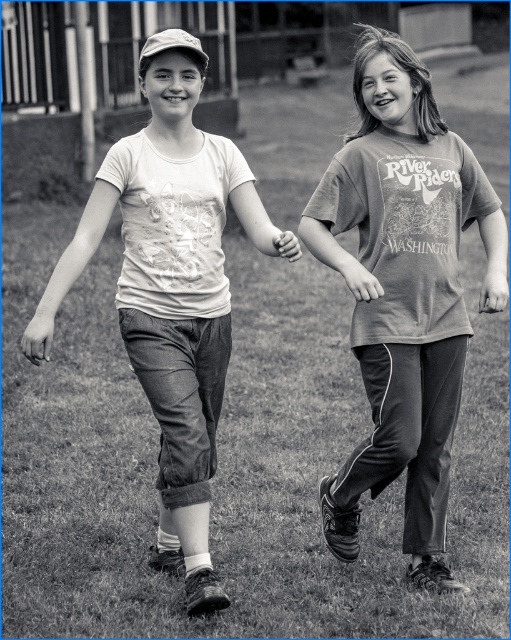
Question: Which object is closer to the camera taking this photo?

Choices:
 (A) printed cotton t-shirt at right
 (B) grassy lawn at center
 (C) smooth skin hand at center
 (D) matte white t-shirt at center

Answer: (C)

Question: Among these objects, which one is farthest from the camera?

Choices:
 (A) matte white t-shirt at center
 (B) grassy lawn at center

Answer: (B)

Question: Can you confirm if matte white t-shirt at center is positioned below smooth skin hand at center?

Choices:
 (A) no
 (B) yes

Answer: (B)

Question: Which object is the closest to the smooth skin hand at center?

Choices:
 (A) matte white t-shirt at center
 (B) printed cotton t-shirt at right
 (C) grassy lawn at center

Answer: (B)

Question: In this image, where is grassy lawn at center located relative to printed cotton t-shirt at right?

Choices:
 (A) above
 (B) below

Answer: (B)

Question: In this image, where is printed cotton t-shirt at right located relative to matte white t-shirt at center?

Choices:
 (A) above
 (B) below

Answer: (A)